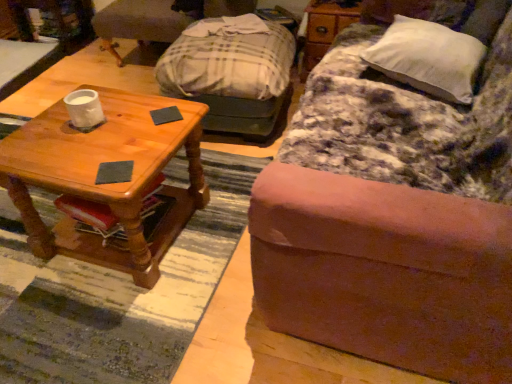
This screenshot has height=384, width=512. What are the coordinates of `free region on the left part of gray felt coaster at center, arranged as the second pad when viewed from the back` in the screenshot? It's located at (75, 165).